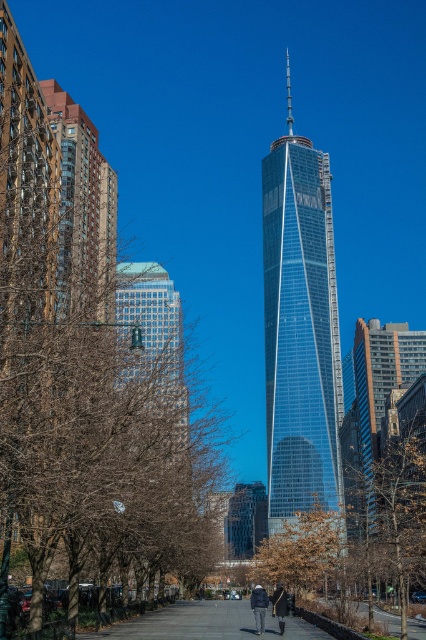
Who is more distant from viewer, (307, 572) or (264, 612)?

The point (307, 572) is behind.

Who is more forward, (388, 541) or (258, 616)?

Point (258, 616)

Between point (408, 492) and point (259, 608), which one is positioned in front?

Positioned in front is point (259, 608).

Image resolution: width=426 pixels, height=640 pixels. I want to click on brown leafy tree at center, so click(x=359, y=541).

Who is positioned more to the right, brown leafless tree at left or dark gray coat at center?

dark gray coat at center is more to the right.

In the scene shown: Between brown leafless tree at left and dark gray coat at center, which one has less height?

Standing shorter between the two is dark gray coat at center.

Which is behind, point (103, 300) or point (281, 584)?

The point (103, 300) is behind.

Locate an element on the screen. The width and height of the screenshot is (426, 640). brown leafless tree at left is located at coordinates (89, 387).

Is point (394, 557) closer to viewer compared to point (389, 356)?

Yes, it is in front of point (389, 356).

Does point (373, 561) lie behind point (385, 340)?

No, (373, 561) is closer to viewer.

Does point (400, 576) come behind point (354, 422)?

No, (400, 576) is closer to viewer.

Where is `brown leafy tree at center`? This screenshot has height=640, width=426. brown leafy tree at center is located at coordinates (359, 541).